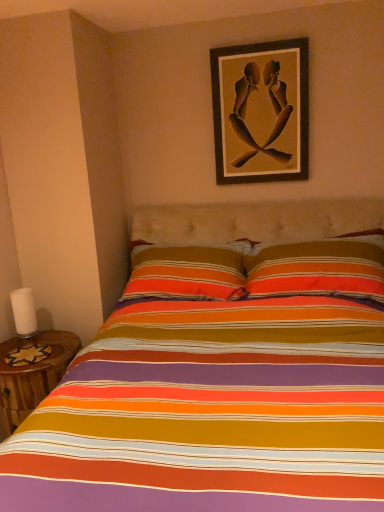
Question: Is wooden table at lower left facing away from white matte candle at left?

Choices:
 (A) no
 (B) yes

Answer: (A)

Question: From a real-world perspective, is wooden table at lower left physically below white matte candle at left?

Choices:
 (A) yes
 (B) no

Answer: (A)

Question: Considering the relative sizes of wooden table at lower left and white matte candle at left in the image provided, is wooden table at lower left bigger than white matte candle at left?

Choices:
 (A) yes
 (B) no

Answer: (A)

Question: Is wooden table at lower left next to white matte candle at left?

Choices:
 (A) yes
 (B) no

Answer: (B)

Question: Is the position of wooden table at lower left less distant than that of white matte candle at left?

Choices:
 (A) yes
 (B) no

Answer: (A)

Question: Is wooden table at lower left oriented towards white matte candle at left?

Choices:
 (A) yes
 (B) no

Answer: (B)

Question: Considering the relative sizes of white matte candle at left and wooden table at lower left in the image provided, is white matte candle at left thinner than wooden table at lower left?

Choices:
 (A) no
 (B) yes

Answer: (B)

Question: From the image's perspective, is white matte candle at left on wooden table at lower left?

Choices:
 (A) no
 (B) yes

Answer: (B)

Question: Are white matte candle at left and wooden table at lower left located far from each other?

Choices:
 (A) yes
 (B) no

Answer: (B)

Question: Is white matte candle at left taller than wooden table at lower left?

Choices:
 (A) no
 (B) yes

Answer: (A)

Question: Does white matte candle at left have a lesser height compared to wooden table at lower left?

Choices:
 (A) no
 (B) yes

Answer: (B)

Question: Does white matte candle at left come in front of wooden table at lower left?

Choices:
 (A) yes
 (B) no

Answer: (B)

Question: From the image's perspective, is wooden picture frame at upper center over white matte candle at left?

Choices:
 (A) yes
 (B) no

Answer: (A)